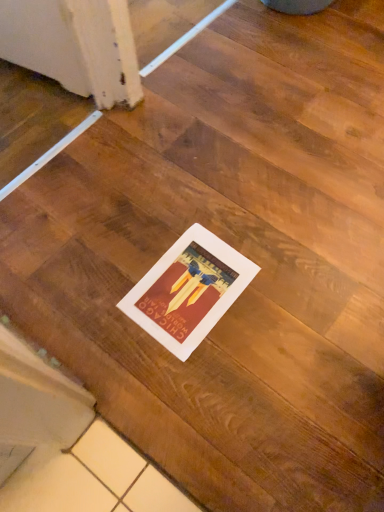
What do you see at coordinates (188, 290) in the screenshot? The height and width of the screenshot is (512, 384). I see `matte paper poster at center` at bounding box center [188, 290].

You are a GUI agent. You are given a task and a screenshot of the screen. Output one action in this format:
    pyautogui.click(x=<x>, y=<y>)
    Task: Click on the matte paper poster at center
    This screenshot has height=512, width=384.
    Given the screenshot: What is the action you would take?
    pyautogui.click(x=188, y=290)

Find the location of a particular element. matte paper poster at center is located at coordinates (188, 290).